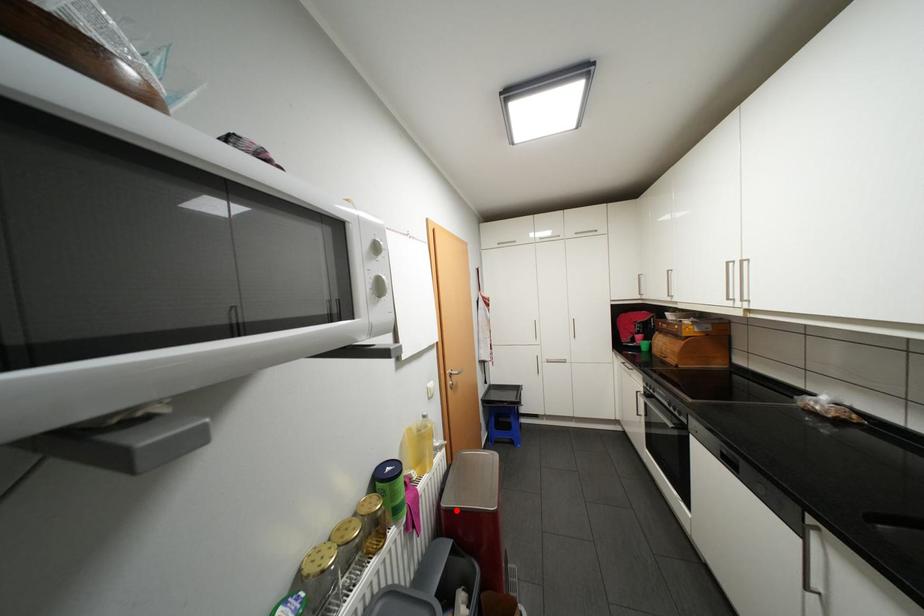
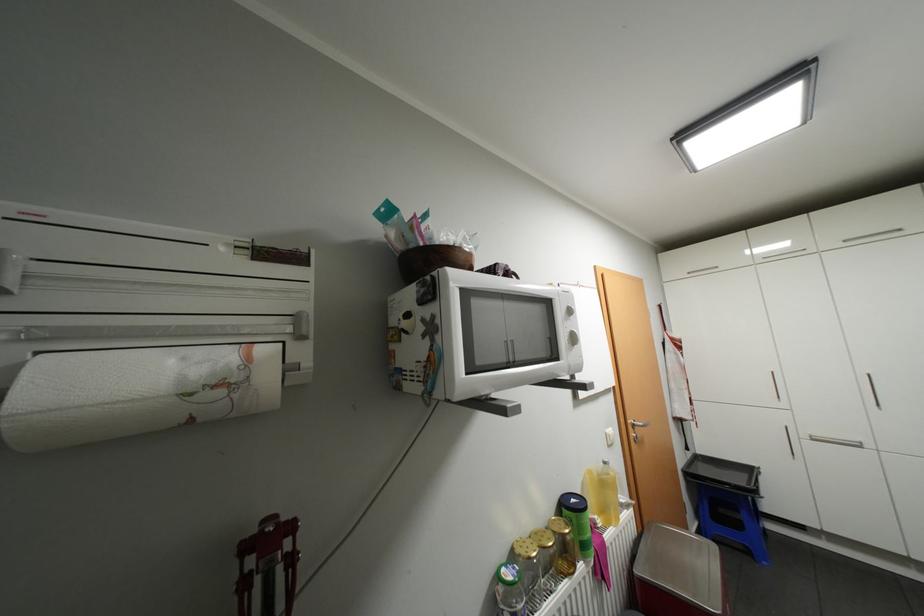
In the second image, find the point that corresponds to the highlighted location in the first image.

(652, 583)